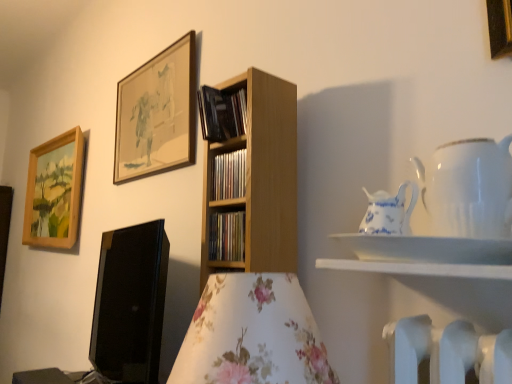
Question: Does blue and white porcelain pitcher at upper right, which appears as the 2th tableware when viewed from the right, come behind wooden framed artwork at upper center, arranged as the second picture frame when viewed from the right?

Choices:
 (A) yes
 (B) no

Answer: (B)

Question: From a real-world perspective, is blue and white porcelain pitcher at upper right, which appears as the 2th tableware when viewed from the right, on wooden framed artwork at upper center, the 2th picture frame positioned from the left?

Choices:
 (A) yes
 (B) no

Answer: (B)

Question: Does blue and white porcelain pitcher at upper right, the first tableware in the left-to-right sequence, contain wooden framed artwork at upper center, the 2th picture frame positioned from the left?

Choices:
 (A) no
 (B) yes

Answer: (A)

Question: Does blue and white porcelain pitcher at upper right, which appears as the 2th tableware when viewed from the right, have a lesser height compared to wooden framed artwork at upper center, acting as the second picture frame starting from the back?

Choices:
 (A) yes
 (B) no

Answer: (A)

Question: Does blue and white porcelain pitcher at upper right, the first tableware in the left-to-right sequence, have a greater width compared to wooden framed artwork at upper center, arranged as the second picture frame when viewed from the right?

Choices:
 (A) yes
 (B) no

Answer: (A)

Question: In terms of width, does wooden shelf at center, the third book viewed from the top, look wider or thinner when compared to white glossy shelf at upper right?

Choices:
 (A) wide
 (B) thin

Answer: (B)

Question: Do you think wooden shelf at center, the third book viewed from the top, is within white glossy shelf at upper right, or outside of it?

Choices:
 (A) inside
 (B) outside

Answer: (B)

Question: From a real-world perspective, is wooden shelf at center, the 1th book ordered from the bottom, positioned above or below white glossy shelf at upper right?

Choices:
 (A) below
 (B) above

Answer: (B)

Question: In the image, is wooden shelf at center, the third book viewed from the top, positioned in front of or behind white glossy shelf at upper right?

Choices:
 (A) behind
 (B) front

Answer: (A)

Question: Based on their sizes in the image, would you say black glossy computer monitor at lower left is bigger or smaller than wooden shelf at center, the second book positioned from the top?

Choices:
 (A) big
 (B) small

Answer: (A)

Question: Do you think black glossy computer monitor at lower left is within wooden shelf at center, which appears as the 2th book when ordered from the bottom, or outside of it?

Choices:
 (A) outside
 (B) inside

Answer: (A)

Question: In terms of height, does black glossy computer monitor at lower left look taller or shorter compared to wooden shelf at center, which appears as the 2th book when ordered from the bottom?

Choices:
 (A) tall
 (B) short

Answer: (A)

Question: From a real-world perspective, is black glossy computer monitor at lower left above or below wooden shelf at center, which appears as the 2th book when ordered from the bottom?

Choices:
 (A) below
 (B) above

Answer: (A)

Question: Looking at their shapes, would you say wooden shelf at center, the 1th book ordered from the bottom, is wider or thinner than black matte book at upper center, marked as the 1th book in a top-to-bottom arrangement?

Choices:
 (A) thin
 (B) wide

Answer: (A)

Question: Choose the correct answer: Is wooden shelf at center, the third book viewed from the top, inside black matte book at upper center, marked as the 1th book in a top-to-bottom arrangement, or outside it?

Choices:
 (A) inside
 (B) outside

Answer: (B)